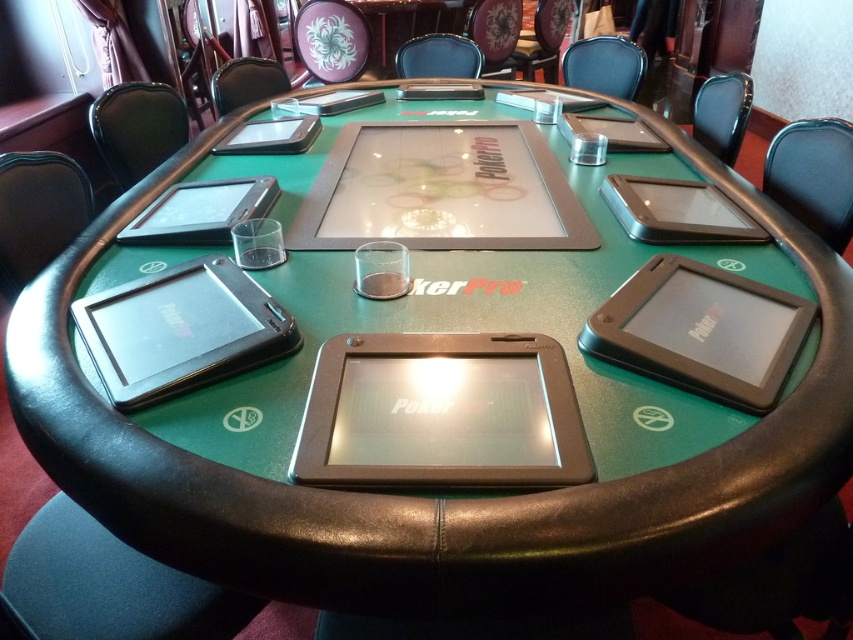
Question: Is matte black tablet at upper center bigger than matte black tablet at upper right?

Choices:
 (A) no
 (B) yes

Answer: (A)

Question: Which point appears farthest from the camera in this image?

Choices:
 (A) (679, 216)
 (B) (167, 368)

Answer: (A)

Question: Does satin black tablet at center come in front of matte black tablet at upper right?

Choices:
 (A) no
 (B) yes

Answer: (B)

Question: Which point is farther from the camera taking this photo?

Choices:
 (A) (669, 284)
 (B) (700, 200)

Answer: (B)

Question: From the image, what is the correct spatial relationship of black plastic ipad at lower right in relation to matte black tablet at upper center?

Choices:
 (A) left
 (B) right

Answer: (B)

Question: Which point is closer to the camera?

Choices:
 (A) black glossy tablet at lower left
 (B) silver metallic tablet at upper right
 (C) black plastic ipad at lower right
 (D) satin black tablet at center

Answer: (D)